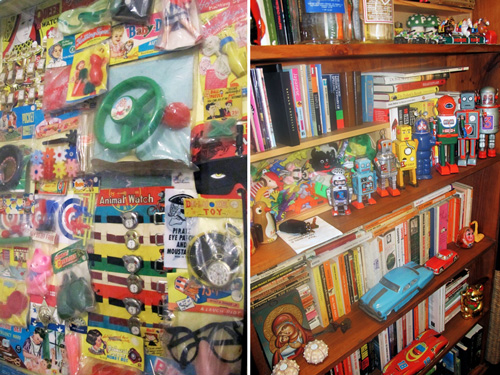
I want to click on books, so click(404, 87), click(299, 101).